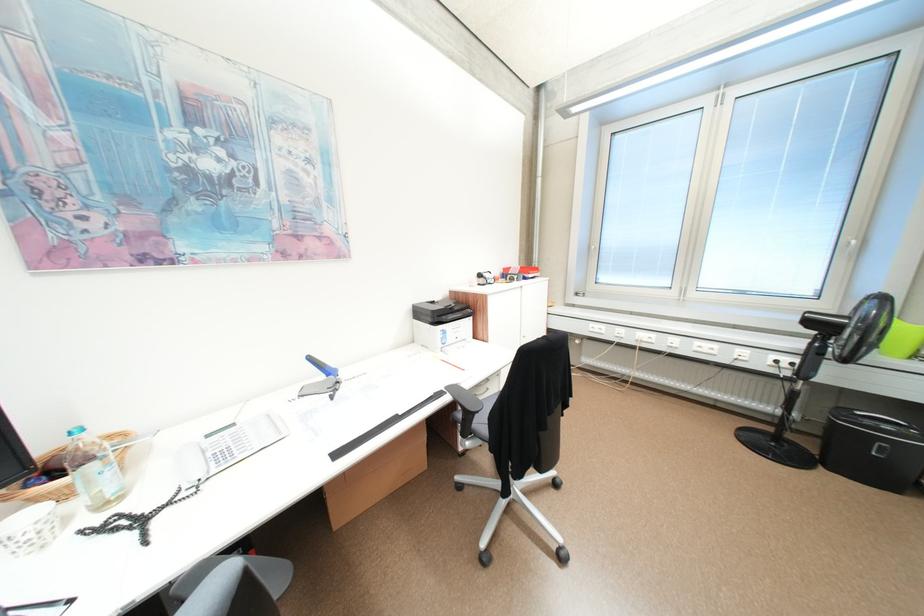
Image resolution: width=924 pixels, height=616 pixels. What do you see at coordinates (322, 367) in the screenshot? I see `a shredder handle` at bounding box center [322, 367].